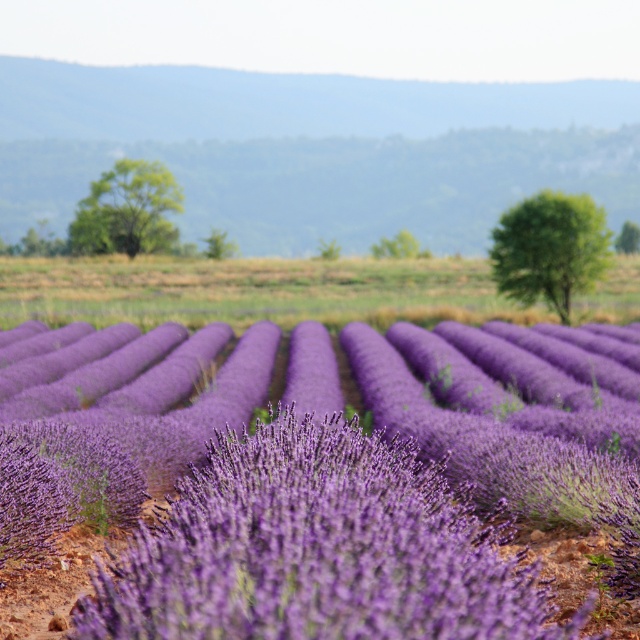
Question: Which point is closer to the camera?

Choices:
 (A) purple soft-textured lavender at center
 (B) purple soft lavender at center

Answer: (A)

Question: Does purple soft-textured lavender at center have a larger size compared to purple soft lavender at center?

Choices:
 (A) no
 (B) yes

Answer: (A)

Question: Which of the following is the farthest from the observer?

Choices:
 (A) (333, 552)
 (B) (394, 310)

Answer: (B)

Question: Does purple soft-textured lavender at center appear under purple soft lavender at center?

Choices:
 (A) yes
 (B) no

Answer: (A)

Question: Is purple soft-textured lavender at center bigger than purple soft lavender at center?

Choices:
 (A) yes
 (B) no

Answer: (B)